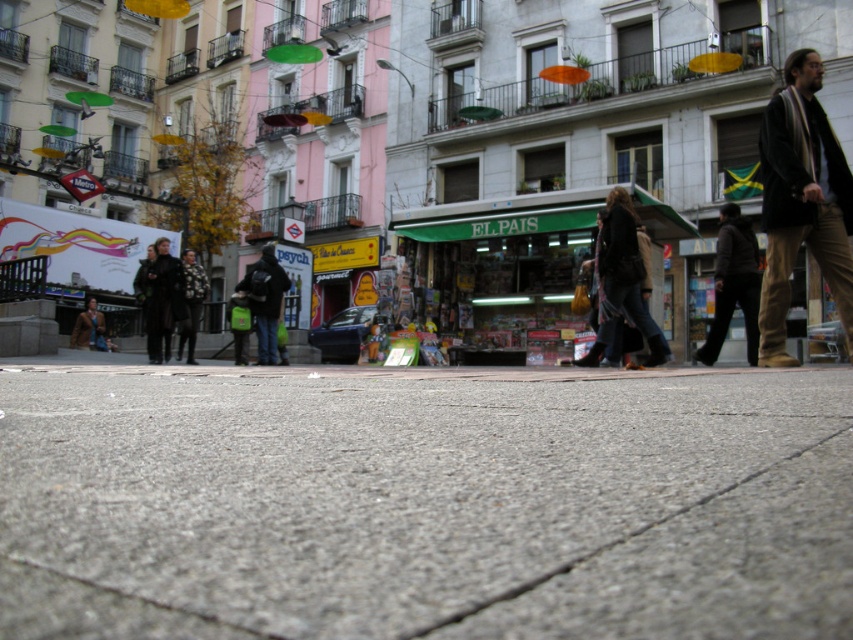
Question: Does dark gray jacket at center have a greater width compared to fluffy black coat at center?

Choices:
 (A) no
 (B) yes

Answer: (A)

Question: Which point is farther to the camera?

Choices:
 (A) (839, 282)
 (B) (635, 260)

Answer: (B)

Question: Which object is the closest to the dark brown leather jacket at left?

Choices:
 (A) green fabric store at center
 (B) dark brown leather jacket at center
 (C) dark gray jacket at center
 (D) brown leather jacket at lower left

Answer: (A)

Question: Which of these objects is positioned closest to the brown woolen jacket at right?

Choices:
 (A) gray concrete pavement at center
 (B) dark brown leather jacket at left

Answer: (A)

Question: Is gray concrete pavement at center further to the viewer compared to dark brown leather jacket at center?

Choices:
 (A) yes
 (B) no

Answer: (B)

Question: Does dark brown leather jacket at left come in front of fluffy black coat at center?

Choices:
 (A) yes
 (B) no

Answer: (A)